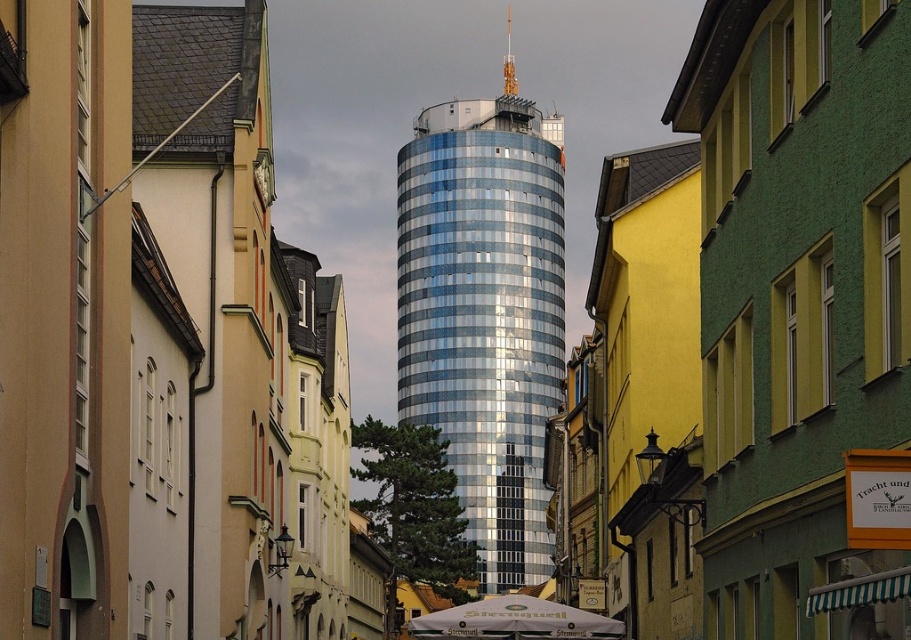
Does point (761, 353) come in front of point (495, 627)?

That is True.

Can you confirm if green textured building at right is positioned below white fabric umbrella at center?

→ Incorrect, green textured building at right is not positioned below white fabric umbrella at center.

Image resolution: width=911 pixels, height=640 pixels. Identify the location of green textured building at right. (799, 305).

At what (x,y) coordinates should I click in order to perform the action: click on green textured building at right. Please return your answer as a coordinate pair (x, y). The height and width of the screenshot is (640, 911). Looking at the image, I should click on (799, 305).

Who is more forward, (774,8) or (545,211)?

Point (774,8) is more forward.

The width and height of the screenshot is (911, 640). Describe the element at coordinates (799, 305) in the screenshot. I see `green textured building at right` at that location.

Is point (820, 602) less distant than point (549, 364)?

That is True.

You are a GUI agent. You are given a task and a screenshot of the screen. Output one action in this format:
    pyautogui.click(x=<x>, y=<y>)
    Task: Click on the green textured building at right
    The width and height of the screenshot is (911, 640).
    Given the screenshot: What is the action you would take?
    pyautogui.click(x=799, y=305)

Which of these two, sleek metallic tower at center or white fabric umbrella at center, stands taller?

With more height is sleek metallic tower at center.

Describe the element at coordinates (485, 312) in the screenshot. This screenshot has width=911, height=640. I see `sleek metallic tower at center` at that location.

You are a GUI agent. You are given a task and a screenshot of the screen. Output one action in this format:
    pyautogui.click(x=<x>, y=<y>)
    Task: Click on the sleek metallic tower at center
    The image size is (911, 640).
    Given the screenshot: What is the action you would take?
    pyautogui.click(x=485, y=312)